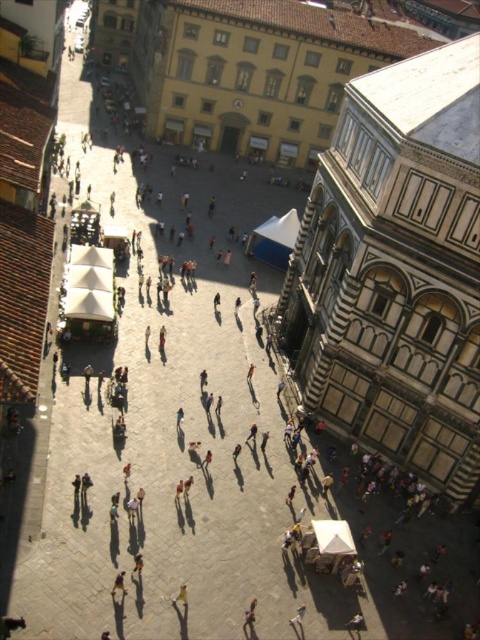
Question: Does light brown leather jacket at lower left come behind light brown wooden chair at center?

Choices:
 (A) yes
 (B) no

Answer: (B)

Question: Among these objects, which one is farthest from the camera?

Choices:
 (A) light brown leather jacket at lower center
 (B) light brown leather jacket at lower left

Answer: (A)

Question: Which point is farther to the camera?

Choices:
 (A) (295, 627)
 (B) (113, 582)

Answer: (B)

Question: Does light brown leather jacket at lower center have a smaller size compared to light brown wooden chair at center?

Choices:
 (A) yes
 (B) no

Answer: (B)

Question: Considering the relative positions of light brown leather jacket at lower center and light brown wooden chair at center in the image provided, where is light brown leather jacket at lower center located with respect to light brown wooden chair at center?

Choices:
 (A) below
 (B) above

Answer: (A)

Question: Which of the following is the farthest from the observer?

Choices:
 (A) light brown wooden chair at center
 (B) light brown leather jacket at lower center

Answer: (A)